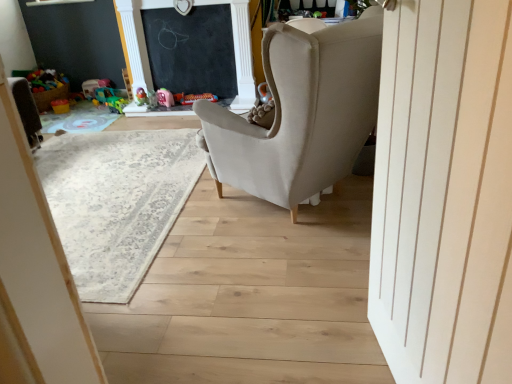
Question: Should I look upward or downward to see beige carpet at center?

Choices:
 (A) down
 (B) up

Answer: (B)

Question: Is pink rubber duck at upper center, which is the fourth toy from left to right, outside matte plastic toy at center, which ranks as the second toy in right-to-left order?

Choices:
 (A) no
 (B) yes

Answer: (B)

Question: Considering the relative sizes of pink rubber duck at upper center, which is the fourth toy from left to right, and matte plastic toy at center, marked as the fifth toy in a left-to-right arrangement, in the image provided, is pink rubber duck at upper center, which is the fourth toy from left to right, smaller than matte plastic toy at center, marked as the fifth toy in a left-to-right arrangement,?

Choices:
 (A) yes
 (B) no

Answer: (A)

Question: Is pink rubber duck at upper center, which is the fourth toy from left to right, wider than matte plastic toy at center, which ranks as the second toy in right-to-left order?

Choices:
 (A) no
 (B) yes

Answer: (A)

Question: Is the position of pink rubber duck at upper center, which is the fourth toy from left to right, more distant than that of matte plastic toy at center, marked as the fifth toy in a left-to-right arrangement?

Choices:
 (A) yes
 (B) no

Answer: (B)

Question: Is pink rubber duck at upper center, which is the third toy in right-to-left order, not close to matte plastic toy at center, which ranks as the second toy in right-to-left order?

Choices:
 (A) no
 (B) yes

Answer: (A)

Question: Is matte plastic toy at center, which ranks as the second toy in right-to-left order, surrounded by pink rubber duck at upper center, which is the third toy in right-to-left order?

Choices:
 (A) no
 (B) yes

Answer: (A)

Question: Can you confirm if beige carpet at center is wider than matte gray plush toy at upper center, the 1th toy from the right?

Choices:
 (A) no
 (B) yes

Answer: (B)

Question: Is beige carpet at center closer to camera compared to matte gray plush toy at upper center, the 1th toy from the right?

Choices:
 (A) no
 (B) yes

Answer: (B)

Question: Is beige carpet at center facing towards matte gray plush toy at upper center, which is the 6th toy from left to right?

Choices:
 (A) yes
 (B) no

Answer: (B)

Question: Can we say beige carpet at center lies outside matte gray plush toy at upper center, which is the 6th toy from left to right?

Choices:
 (A) yes
 (B) no

Answer: (A)

Question: From a real-world perspective, is beige carpet at center positioned under matte gray plush toy at upper center, the 1th toy from the right, based on gravity?

Choices:
 (A) no
 (B) yes

Answer: (B)

Question: From the image's perspective, is beige carpet at center below matte gray plush toy at upper center, the 1th toy from the right?

Choices:
 (A) yes
 (B) no

Answer: (A)

Question: Considering the relative sizes of matte orange toy at center, the 1th toy from the left, and rubberized green toy at upper left, which is counted as the 3th toy, starting from the left, in the image provided, is matte orange toy at center, the 1th toy from the left, thinner than rubberized green toy at upper left, which is counted as the 3th toy, starting from the left,?

Choices:
 (A) yes
 (B) no

Answer: (B)